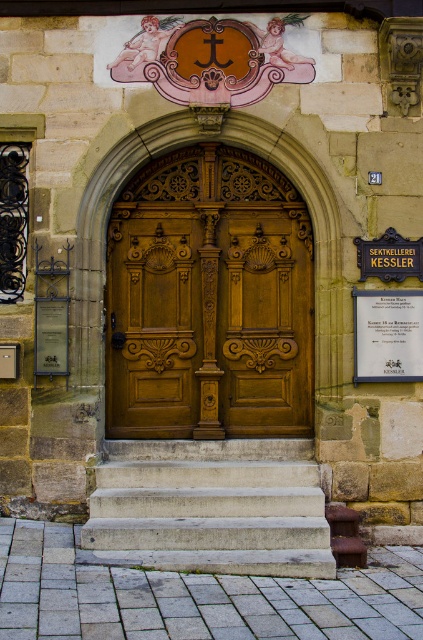
Find the location of a particular element. white concrete stairs at center is located at coordinates (211, 508).

Does white concrete stairs at center appear under matte gold plaque at center?

Yes, white concrete stairs at center is below matte gold plaque at center.

Which is behind, point (181, 548) or point (403, 321)?

Point (403, 321)

Identify the location of white concrete stairs at center. The width and height of the screenshot is (423, 640). (211, 508).

Does polished wood door at center come behind matte silver plaque at lower left?

Yes.

Does point (261, 356) come in front of point (60, 356)?

That is False.

Which is behind, point (131, 413) or point (43, 324)?

The point (131, 413) is behind.

Image resolution: width=423 pixels, height=640 pixels. In order to click on polished wood door at center in this screenshot , I will do `click(208, 300)`.

Which is more to the right, polished wood door at center or wooden door at center?

polished wood door at center

Is polished wood door at center to the right of wooden door at center from the viewer's perspective?

Indeed, polished wood door at center is positioned on the right side of wooden door at center.

Is point (142, 355) farther from camera compared to point (143, 321)?

No.

What are the coordinates of `polished wood door at center` in the screenshot? It's located at (208, 300).